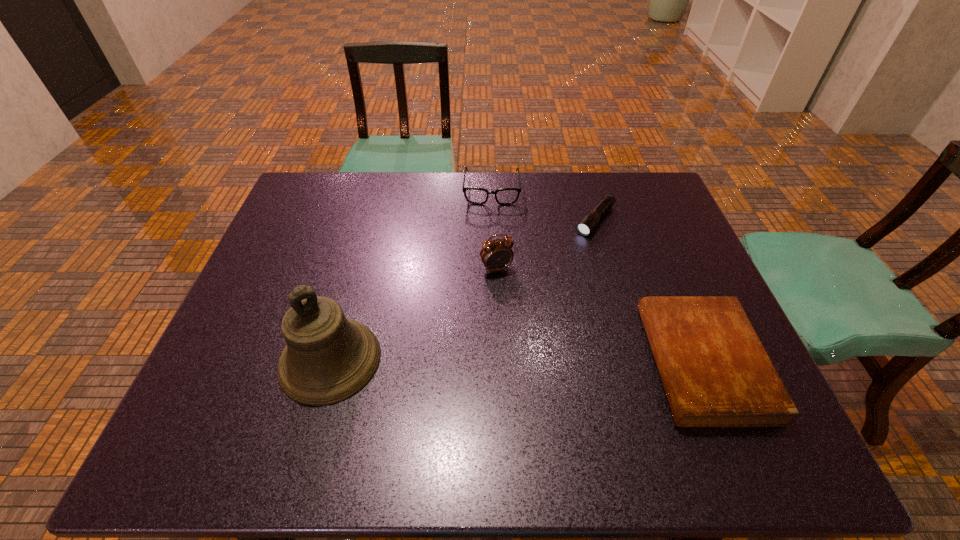
The image size is (960, 540). What are the coordinates of `flashlight located in the far edge section of the desktop` in the screenshot? It's located at (590, 221).

You are a GUI agent. You are given a task and a screenshot of the screen. Output one action in this format:
    pyautogui.click(x=<x>, y=<y>)
    Task: Click on the spectacles that is at the far edge
    This screenshot has width=960, height=540.
    Given the screenshot: What is the action you would take?
    pyautogui.click(x=504, y=196)

Find the location of a particular element. This screenshot has height=540, width=960. bell positioned at the near edge is located at coordinates (328, 358).

Where is `Bible located at the near edge`? The image size is (960, 540). Bible located at the near edge is located at coordinates (715, 371).

Locate an element on the screen. The width and height of the screenshot is (960, 540). object located in the left edge section of the desktop is located at coordinates point(328,358).

Where is `object that is at the right edge`? The width and height of the screenshot is (960, 540). object that is at the right edge is located at coordinates (715, 371).

Identify the location of object present at the near left corner. The height and width of the screenshot is (540, 960). (328, 358).

Locate an element on the screen. This screenshot has width=960, height=540. object positioned at the near right corner is located at coordinates (715, 371).

Find the location of a particular element. vacant space at the far edge of the desktop is located at coordinates (419, 183).

You are a GUI agent. You are given a task and a screenshot of the screen. Output one action in this format:
    pyautogui.click(x=<x>, y=<y>)
    Task: Click on the blank space at the near edge of the desktop
    The height and width of the screenshot is (540, 960).
    Given the screenshot: What is the action you would take?
    pyautogui.click(x=278, y=388)